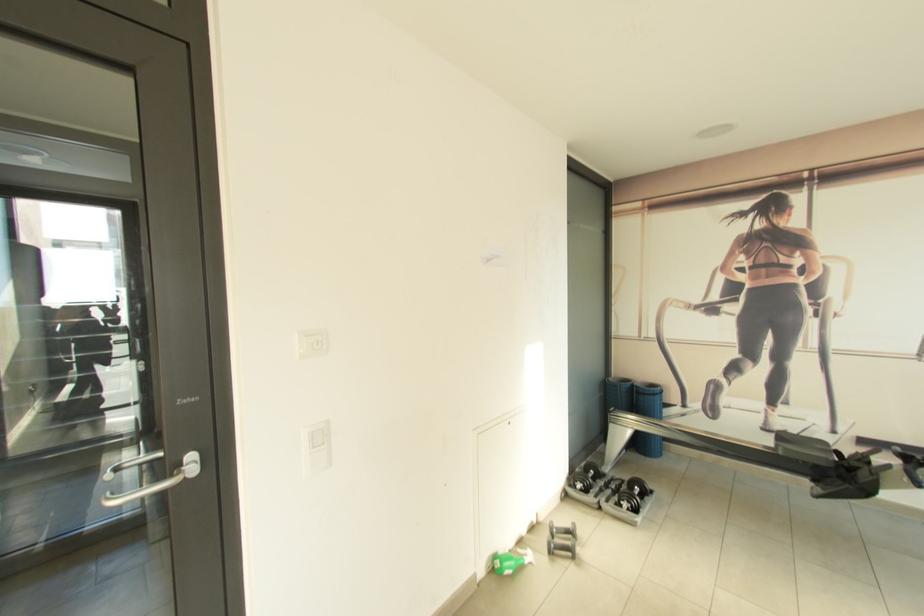
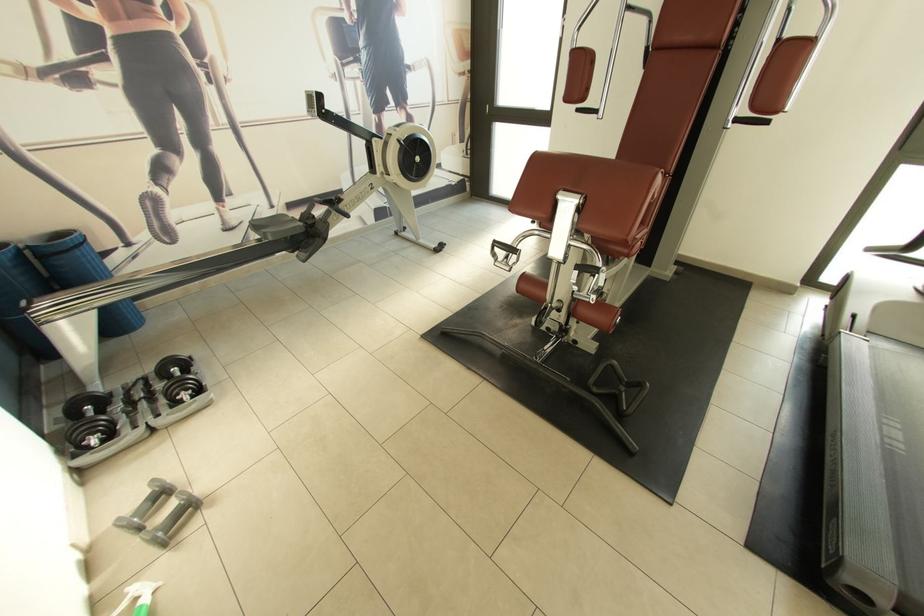
Find the pixel in the second image that matches point (554, 545) in the first image.

(159, 541)